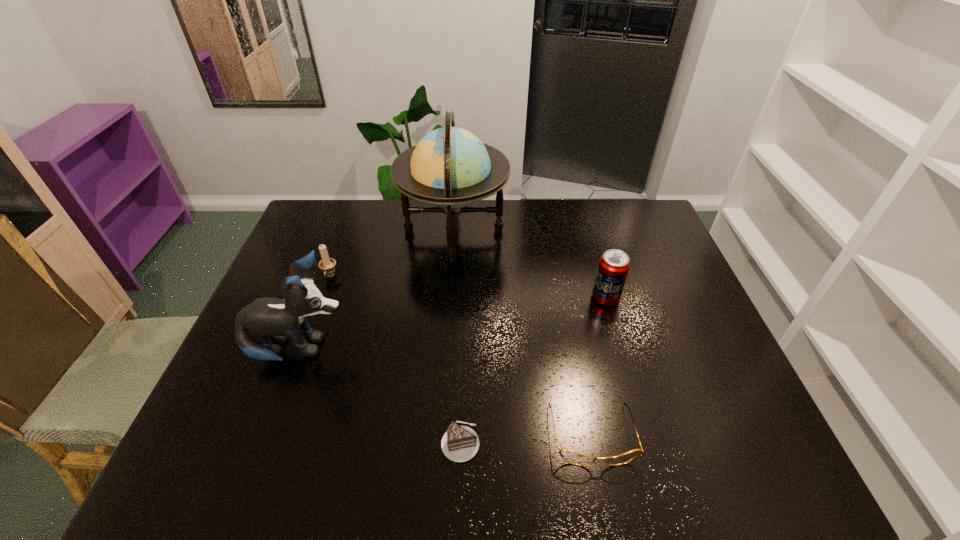
Identify the location of vacant region that satisfies the following two spatial constraints: 1. on the surface of the globe; 2. on the handle side of the third shortest object. Image resolution: width=960 pixels, height=540 pixels. (450, 276).

Where is `vacant space that satisfies the following two spatial constraints: 1. on the surface of the globe; 2. on the left side of the chocolate cake`? Image resolution: width=960 pixels, height=540 pixels. vacant space that satisfies the following two spatial constraints: 1. on the surface of the globe; 2. on the left side of the chocolate cake is located at coordinates (439, 442).